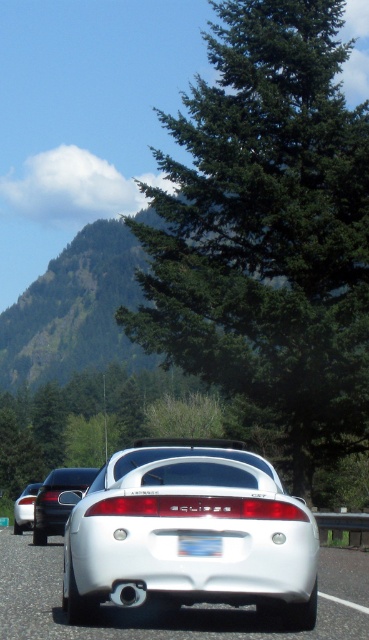
Question: Which point is closer to the camera?

Choices:
 (A) (83, 483)
 (B) (25, 516)

Answer: (A)

Question: Which point is closer to the camera taking this photo?

Choices:
 (A) (221, 538)
 (B) (21, 525)

Answer: (A)

Question: Is white glossy sports car at center to the left of white matte sedan at center from the viewer's perspective?

Choices:
 (A) no
 (B) yes

Answer: (A)

Question: Estimate the real-world distances between objects in this image. Which object is closer to the white glossy car at center?

Choices:
 (A) white plastic license plate at center
 (B) white glossy sports car at center
 (C) matte black car at center

Answer: (A)

Question: Is white glossy sports car at center positioned in front of matte black car at center?

Choices:
 (A) yes
 (B) no

Answer: (A)

Question: Is matte black car at center wider than white matte sedan at center?

Choices:
 (A) yes
 (B) no

Answer: (A)